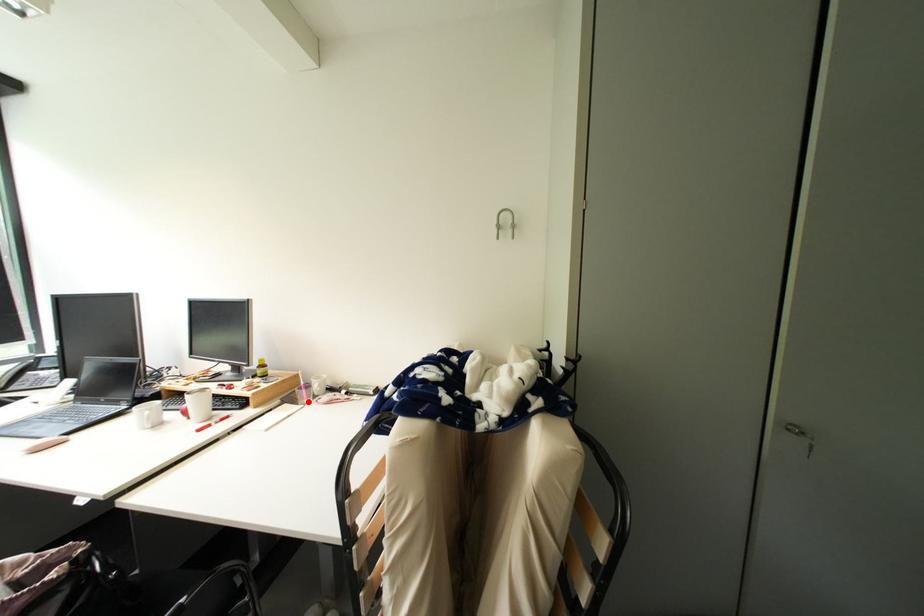
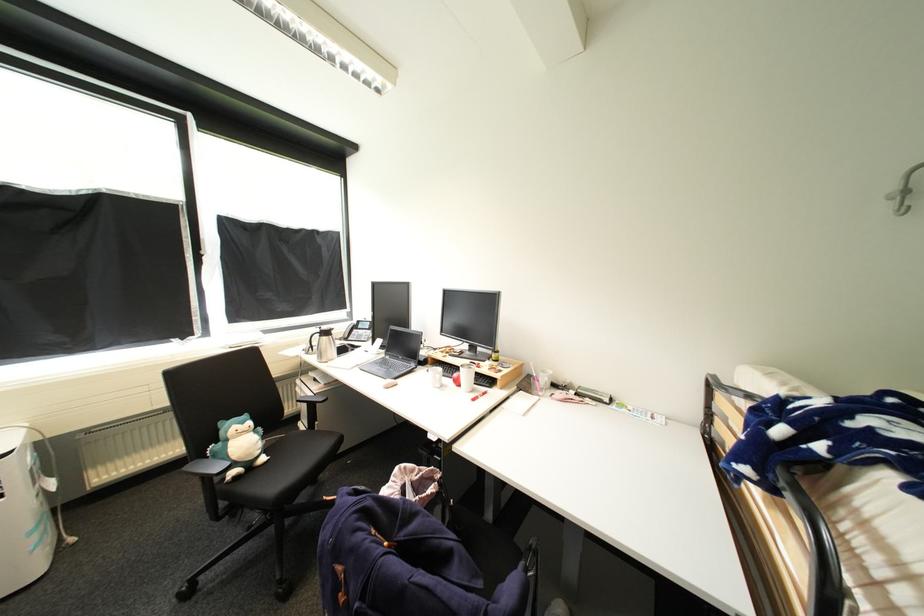
Question: I am providing you with two images of the same scene from different viewpoints. A red point is marked on the first image. At the location where the point appears in image 1, is it still visible in image 2?

Choices:
 (A) Yes
 (B) No

Answer: (A)